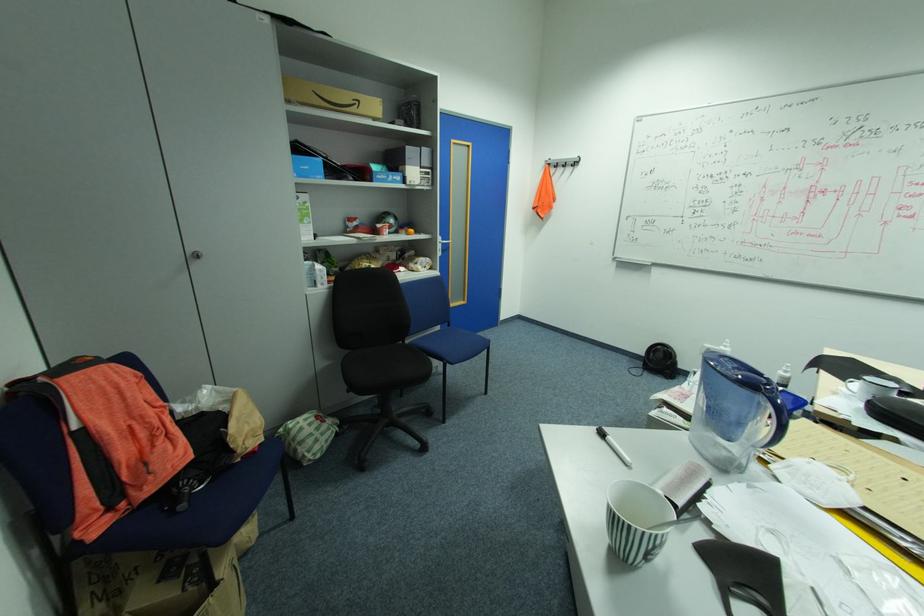
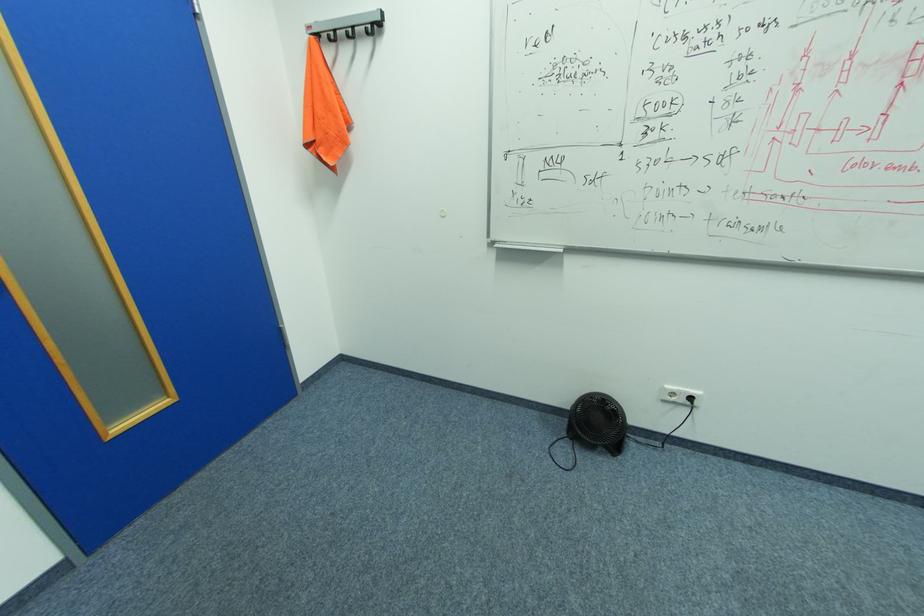
Find the pixel in the second image that matches [569,167] in the first image.

(355, 34)